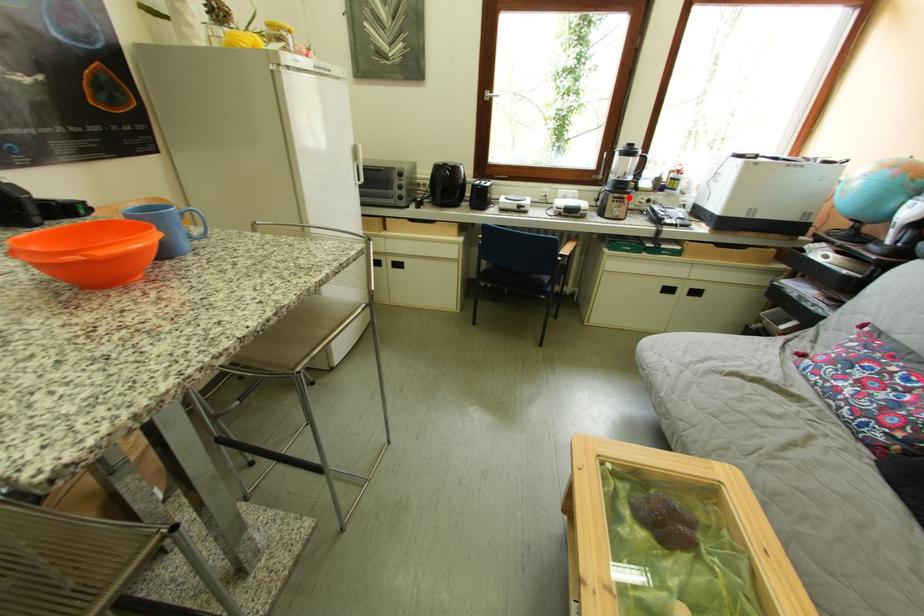
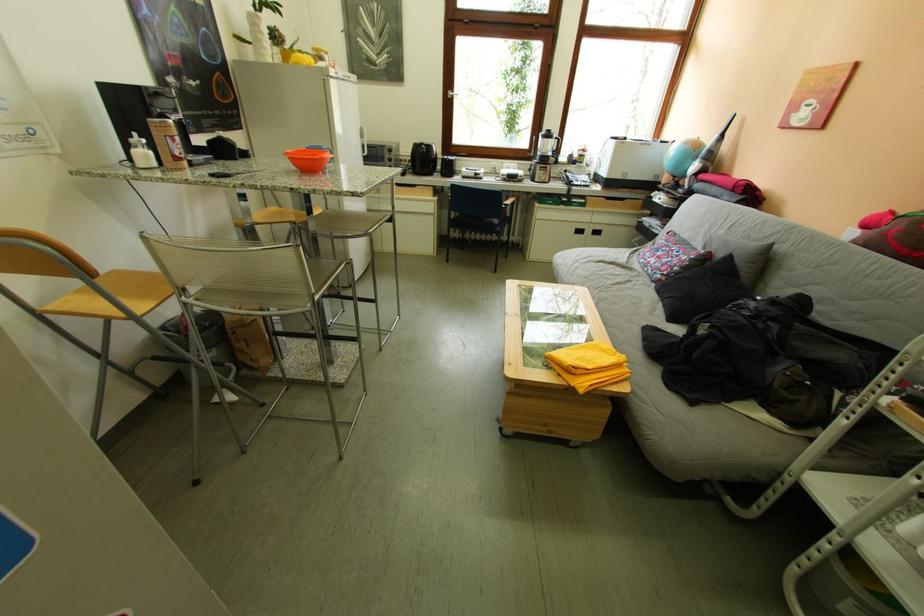
Question: A red point is marked in image1. In image2, is the corresponding 3D point closer to the camera or farther? Reply with the corresponding letter.

Choices:
 (A) The corresponding 3D point is closer.
 (B) The corresponding 3D point is farther.

Answer: (A)